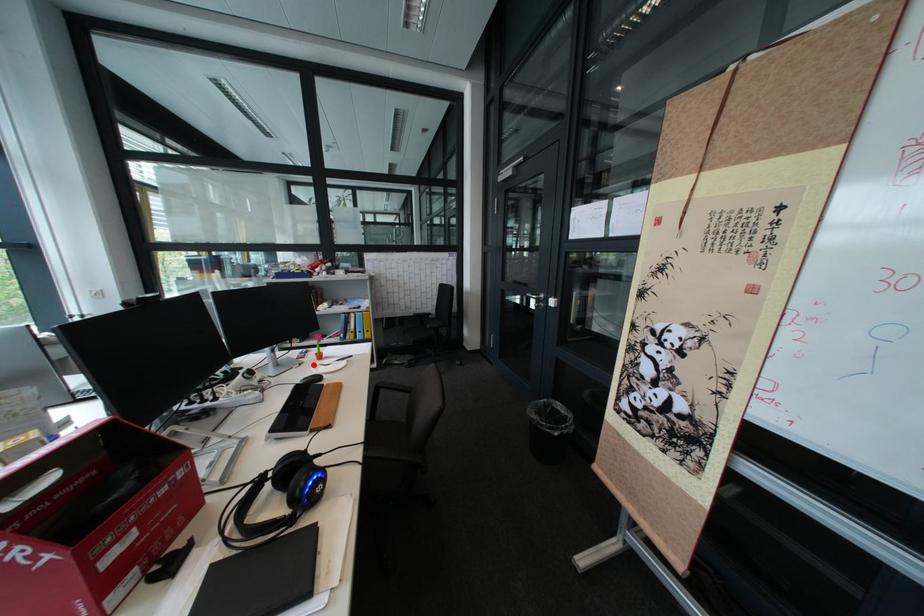
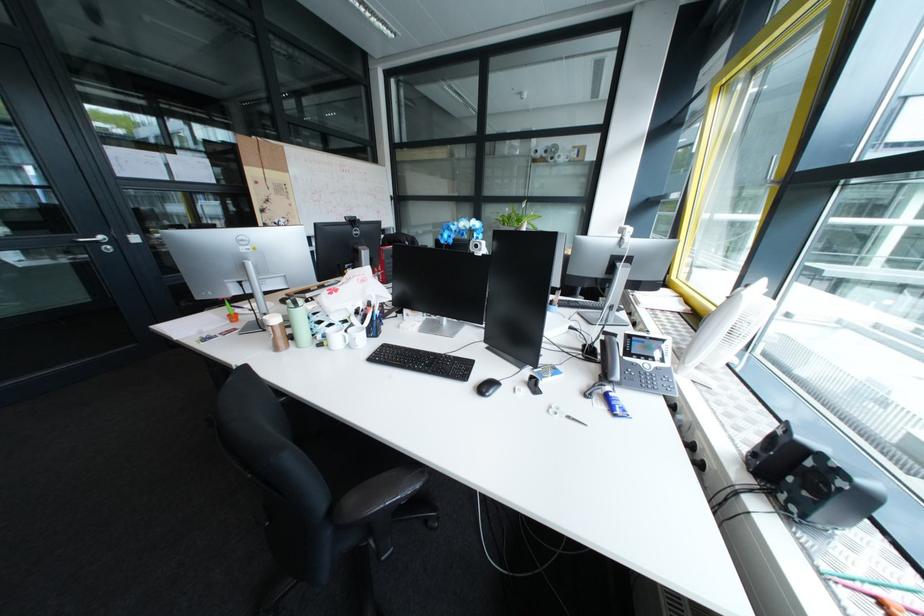
Question: I am providing you with two images of the same scene from different viewpoints. A red point is marked on the first image. Is the red point's position out of view in image 2?

Choices:
 (A) Yes
 (B) No

Answer: (A)